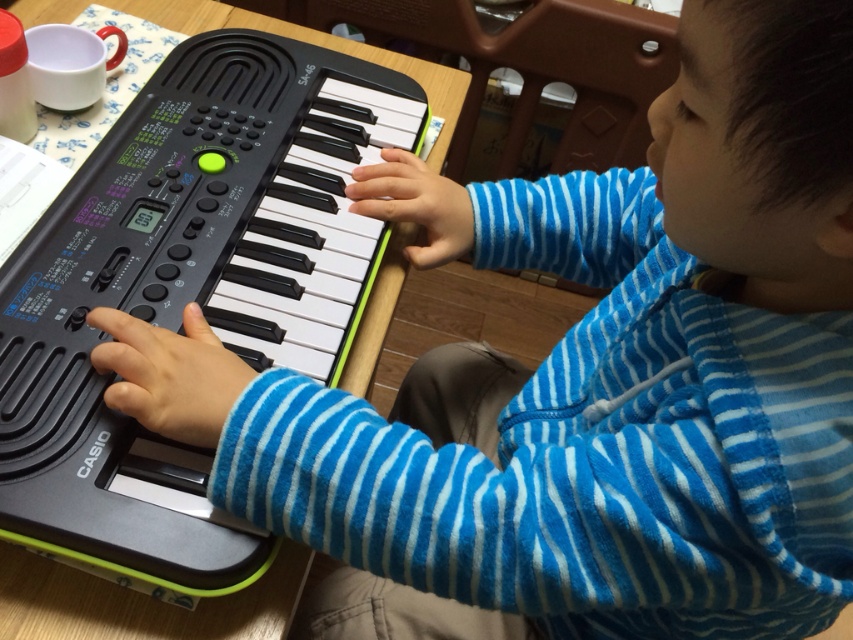
Question: Can you confirm if black plastic keyboard at center is positioned below black matte keyboard key at center?

Choices:
 (A) no
 (B) yes

Answer: (A)

Question: Among these points, which one is nearest to the camera?

Choices:
 (A) (149, 401)
 (B) (393, 157)
 (C) (299, 125)

Answer: (A)

Question: Is black matte keyboard key at center thinner than black matte keyboard keys at center?

Choices:
 (A) yes
 (B) no

Answer: (A)

Question: Is black matte keyboard key at center to the right of black matte keyboard keys at center from the viewer's perspective?

Choices:
 (A) yes
 (B) no

Answer: (B)

Question: Which object appears farthest from the camera in this image?

Choices:
 (A) black plastic keyboard at center
 (B) black matte keyboard key at center

Answer: (B)

Question: Which point appears closest to the camera in this image?

Choices:
 (A) (157, 368)
 (B) (62, 221)
 (C) (410, 192)

Answer: (A)